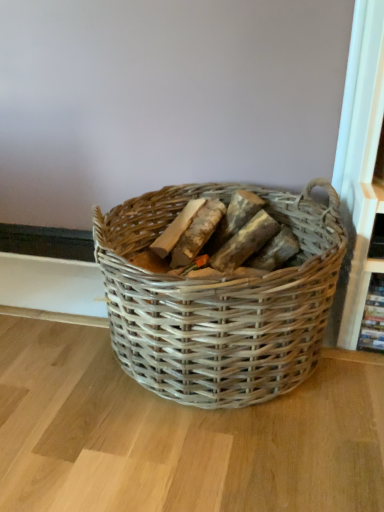
This screenshot has height=512, width=384. Identify the location of free space to the left of natural wicker basket at center. (49, 326).